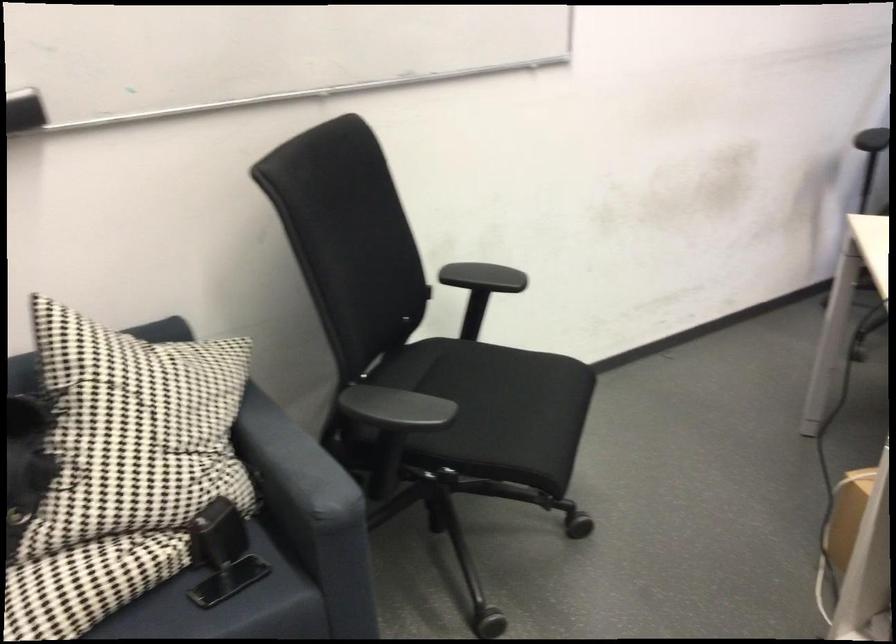
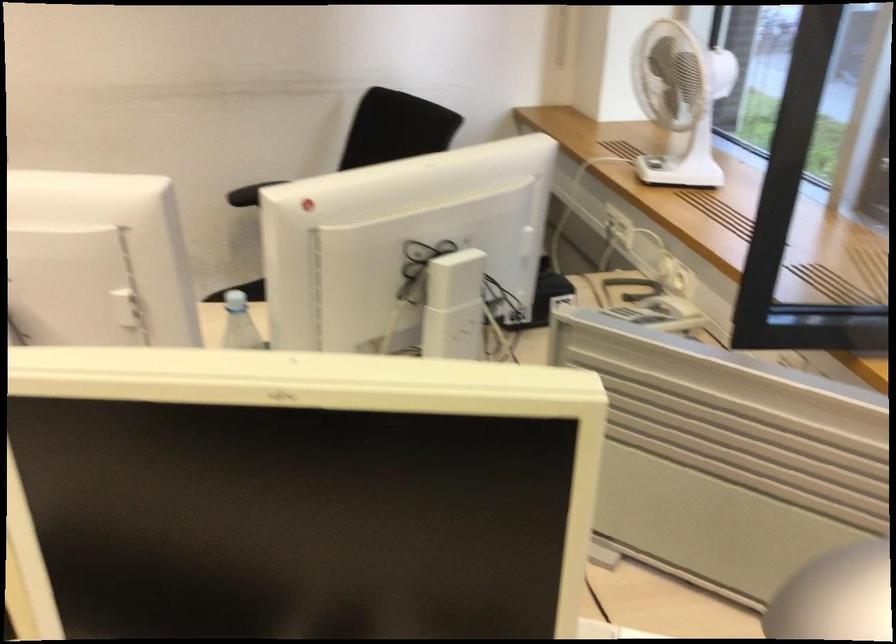
Question: Which direction would the cameraman need to move to produce the second image? Reply with the corresponding letter.

Choices:
 (A) Left
 (B) Right
 (C) Forward
 (D) Backward

Answer: (B)